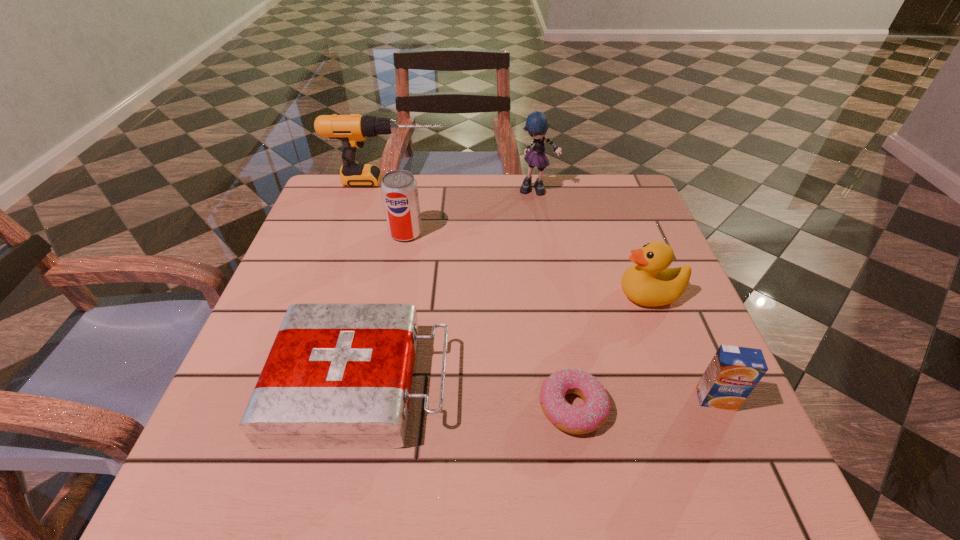
Image resolution: width=960 pixels, height=540 pixels. I want to click on vacant point that satisfies the following two spatial constraints: 1. on the back side of the orange_juice; 2. on the handle side of the drill, so click(622, 181).

Identify the location of free location that satisfies the following two spatial constraints: 1. on the front side of the first-aid kit; 2. on the back side of the doughnut. The image size is (960, 540). (357, 408).